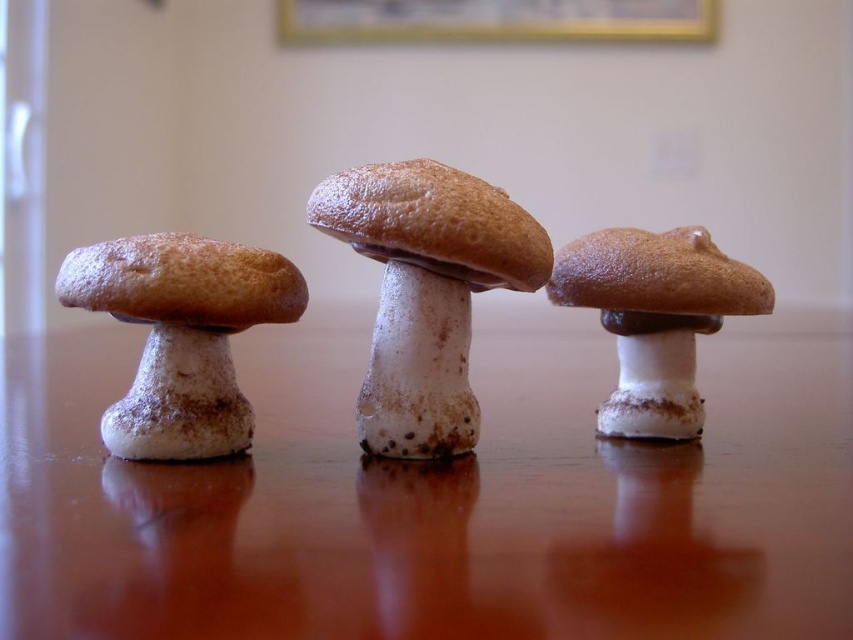
Question: Which point is farther from the camera taking this photo?

Choices:
 (A) (241, 404)
 (B) (93, 520)
 (C) (596, 288)
 (D) (383, 241)

Answer: (C)

Question: Based on their relative distances, which object is nearer to the brown matte table at center?

Choices:
 (A) spongy white mushroom at center
 (B) brown matte mushroom at center
 (C) matte brown mushroom at left
 (D) gold-framed picture at upper center

Answer: (B)

Question: Does spongy white mushroom at center appear on the left side of matte brown mushroom at left?

Choices:
 (A) yes
 (B) no

Answer: (B)

Question: Considering the relative positions of brown matte table at center and spongy white mushroom at center in the image provided, where is brown matte table at center located with respect to spongy white mushroom at center?

Choices:
 (A) right
 (B) left

Answer: (B)

Question: Which object is positioned closest to the matte brown mushroom at left?

Choices:
 (A) brown matte mushroom at center
 (B) brown matte table at center

Answer: (B)

Question: Does brown matte table at center have a smaller size compared to gold-framed picture at upper center?

Choices:
 (A) yes
 (B) no

Answer: (B)